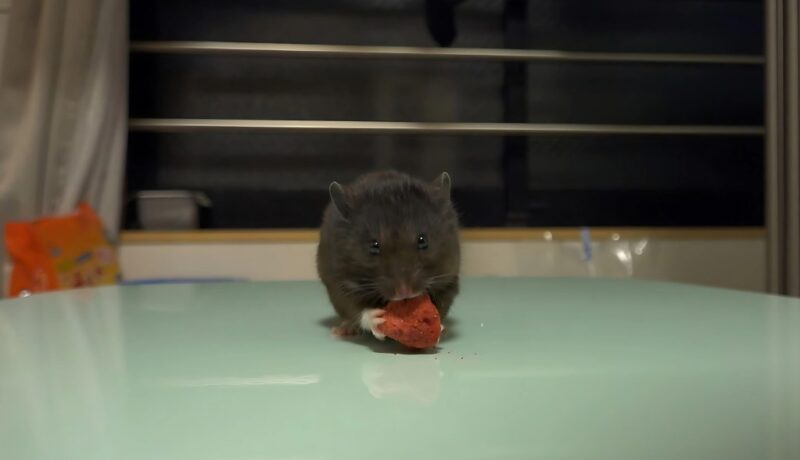
Locate an element on the screen. table is located at coordinates (221, 364), (537, 371).